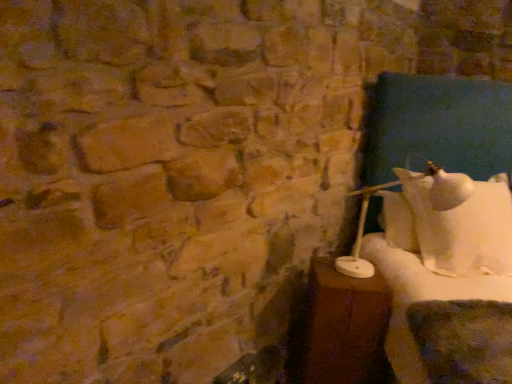
Question: Does white matte table lamp at right have a greater height compared to brown wooden table at right?

Choices:
 (A) yes
 (B) no

Answer: (B)

Question: Is white matte table lamp at right not near brown wooden table at right?

Choices:
 (A) yes
 (B) no

Answer: (B)

Question: Is the depth of white matte table lamp at right less than that of brown wooden table at right?

Choices:
 (A) yes
 (B) no

Answer: (A)

Question: Is white matte table lamp at right at the left side of brown wooden table at right?

Choices:
 (A) yes
 (B) no

Answer: (B)

Question: Considering the relative positions of white matte table lamp at right and brown wooden table at right in the image provided, is white matte table lamp at right to the right of brown wooden table at right from the viewer's perspective?

Choices:
 (A) yes
 (B) no

Answer: (A)

Question: Can you confirm if white matte table lamp at right is bigger than brown wooden table at right?

Choices:
 (A) yes
 (B) no

Answer: (A)

Question: Can we say brown wooden table at right lies outside white matte table lamp at right?

Choices:
 (A) no
 (B) yes

Answer: (B)

Question: Is brown wooden table at right far away from white matte table lamp at right?

Choices:
 (A) yes
 (B) no

Answer: (B)

Question: Is brown wooden table at right facing towards white matte table lamp at right?

Choices:
 (A) yes
 (B) no

Answer: (B)

Question: From the image's perspective, would you say brown wooden table at right is positioned over white matte table lamp at right?

Choices:
 (A) no
 (B) yes

Answer: (A)

Question: From the image's perspective, is brown wooden table at right below white matte table lamp at right?

Choices:
 (A) yes
 (B) no

Answer: (A)

Question: Can you see brown wooden table at right touching white matte table lamp at right?

Choices:
 (A) no
 (B) yes

Answer: (A)

Question: Considering the positions of brown wooden table at right and white matte table lamp at right in the image, is brown wooden table at right wider or thinner than white matte table lamp at right?

Choices:
 (A) thin
 (B) wide

Answer: (A)